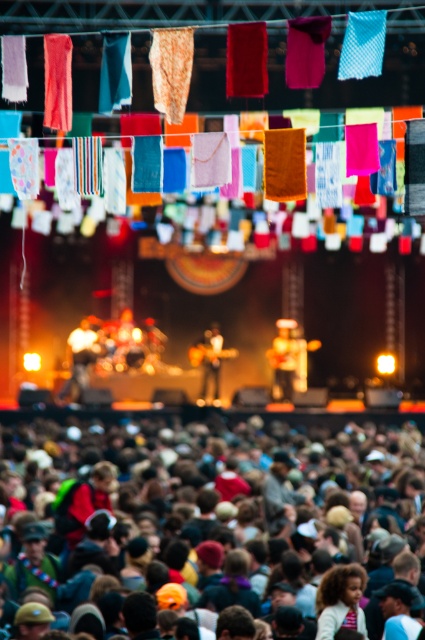
You are a photographer at the concert and want to capture both the matte brown guitar at center and the wooden guitar at center in a single frame. Given their sizes, which guitar should you position closer to the camera to ensure both are visible clearly?

The matte brown guitar at center is smaller than the wooden guitar at center. To ensure both are visible clearly in the frame, you should position the smaller matte brown guitar at center closer to the camera so that its size matches the larger wooden guitar at center in the photograph.

You are a photographer at the concert trying to capture a photo of the stage. You notice the multicolored fabric at lower center and the matte brown guitar at center. Which object should you focus on if you want to highlight the larger one in your shot?

The multicolored fabric at lower center is larger in size than the matte brown guitar at center, so you should focus on the multicolored fabric at lower center to highlight the larger object.

You are a photographer at the concert and want to capture a clear shot of both the matte black guitar at center and the wooden guitar at center. Since the stage is lit with warm golden lights, which guitar should you focus on to ensure it appears taller in the photo?

The wooden guitar at center is taller than the matte black guitar at center, so focusing on the wooden guitar at center would ensure it appears taller in the photo.